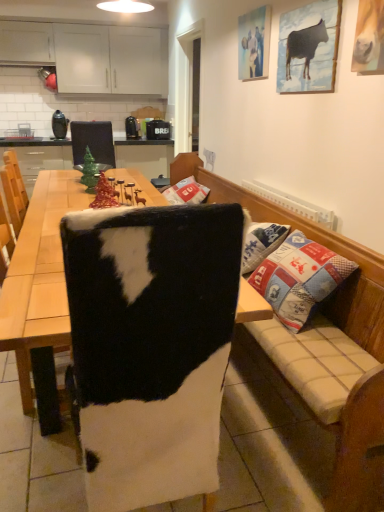
Question: From the image's perspective, does cowhide at center appear higher than wooden picture frame at upper right, positioned as the second picture frame in back-to-front order?

Choices:
 (A) yes
 (B) no

Answer: (B)

Question: From a real-world perspective, is cowhide at center located higher than wooden picture frame at upper right, positioned as the second picture frame in back-to-front order?

Choices:
 (A) yes
 (B) no

Answer: (B)

Question: Could you tell me if cowhide at center is facing wooden picture frame at upper right, which appears as the 1th picture frame when viewed from the front?

Choices:
 (A) no
 (B) yes

Answer: (A)

Question: Does cowhide at center come behind wooden picture frame at upper right, which is counted as the 2th picture frame, starting from the left?

Choices:
 (A) no
 (B) yes

Answer: (A)

Question: Is cowhide at center not inside wooden picture frame at upper right, positioned as the second picture frame in back-to-front order?

Choices:
 (A) yes
 (B) no

Answer: (A)

Question: Considering the positions of point (332, 5) and point (291, 222), is point (332, 5) closer or farther from the camera than point (291, 222)?

Choices:
 (A) closer
 (B) farther

Answer: (A)

Question: From a real-world perspective, is wooden picture frame at upper right, which is counted as the 2th picture frame, starting from the left, above or below cowhide cushion at center?

Choices:
 (A) above
 (B) below

Answer: (A)

Question: Relative to cowhide cushion at center, is wooden picture frame at upper right, positioned as the second picture frame in back-to-front order, in front or behind?

Choices:
 (A) front
 (B) behind

Answer: (B)

Question: Looking at their shapes, would you say wooden picture frame at upper right, which is counted as the 2th picture frame, starting from the left, is wider or thinner than cowhide cushion at center?

Choices:
 (A) wide
 (B) thin

Answer: (B)

Question: Considering their positions, is white matte cabinets at upper left located in front of or behind wooden picture frame at upper right, which is counted as the 2th picture frame, starting from the left?

Choices:
 (A) behind
 (B) front

Answer: (A)

Question: From their relative heights in the image, would you say white matte cabinets at upper left is taller or shorter than wooden picture frame at upper right, which is counted as the 2th picture frame, starting from the left?

Choices:
 (A) short
 (B) tall

Answer: (B)

Question: In terms of size, does white matte cabinets at upper left appear bigger or smaller than wooden picture frame at upper right, which is counted as the 2th picture frame, starting from the left?

Choices:
 (A) big
 (B) small

Answer: (A)

Question: Considering the positions of white matte cabinets at upper left and wooden picture frame at upper right, positioned as the second picture frame in back-to-front order, in the image, is white matte cabinets at upper left wider or thinner than wooden picture frame at upper right, positioned as the second picture frame in back-to-front order,?

Choices:
 (A) thin
 (B) wide

Answer: (B)

Question: Looking at the image, does white matte cabinets at upper left seem bigger or smaller compared to green glossy christmas tree at upper left?

Choices:
 (A) big
 (B) small

Answer: (A)

Question: Considering the positions of point (31, 58) and point (91, 178), is point (31, 58) closer or farther from the camera than point (91, 178)?

Choices:
 (A) closer
 (B) farther

Answer: (B)